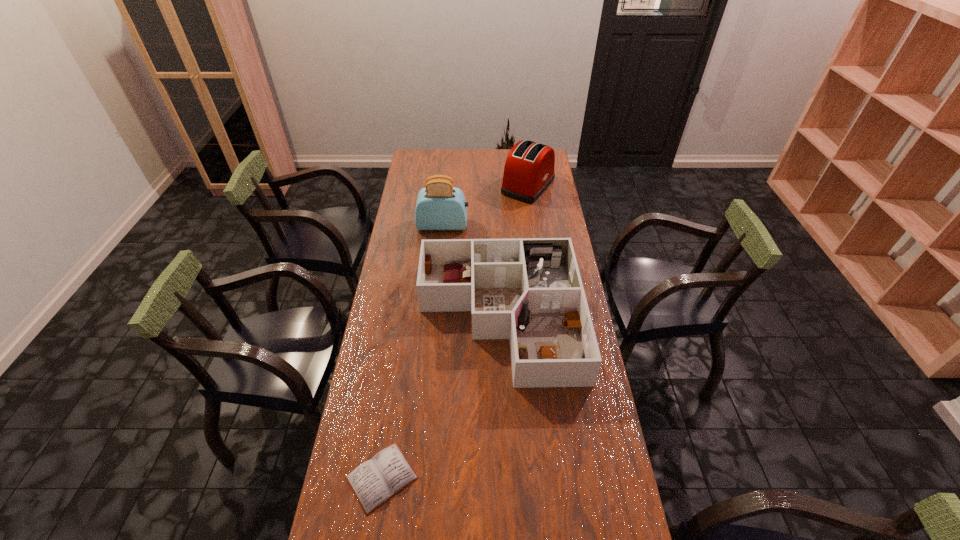
You are a GUI agent. You are given a task and a screenshot of the screen. Output one action in this format:
    pyautogui.click(x=<x>, y=<y>)
    Task: Click on the free region at the left edge
    The width and height of the screenshot is (960, 540).
    Given the screenshot: What is the action you would take?
    pyautogui.click(x=407, y=234)

Image resolution: width=960 pixels, height=540 pixels. Identify the location of free space at the right edge of the desktop. (530, 218).

Image resolution: width=960 pixels, height=540 pixels. Identify the location of vacant region between the shortest object and the left toaster. point(413,351).

The height and width of the screenshot is (540, 960). What are the coordinates of `free point between the third nearest object and the nearest object` in the screenshot? It's located at [x=413, y=351].

At what (x,y) coordinates should I click in order to perform the action: click on vacant point located between the farthest object and the second farthest object. Please return your answer as a coordinate pair (x, y). The image size is (960, 540). Looking at the image, I should click on (486, 206).

The height and width of the screenshot is (540, 960). What are the coordinates of `free spot between the dollhouse and the diary` in the screenshot? It's located at (441, 397).

Locate an element on the screen. empty space that is in between the shortest object and the right toaster is located at coordinates (455, 332).

Where is `the second closest object to the left toaster`? This screenshot has width=960, height=540. the second closest object to the left toaster is located at coordinates coord(529,290).

I want to click on the closest object to the second nearest object, so click(x=375, y=481).

You are a GUI agent. You are given a task and a screenshot of the screen. Output one action in this format:
    pyautogui.click(x=<x>, y=<y>)
    Task: Click on the free spot that satisfies the following two spatial constraints: 1. on the front side of the right toaster; 2. on the side of the second farthest object with the lever
    
    Given the screenshot: What is the action you would take?
    pyautogui.click(x=534, y=225)